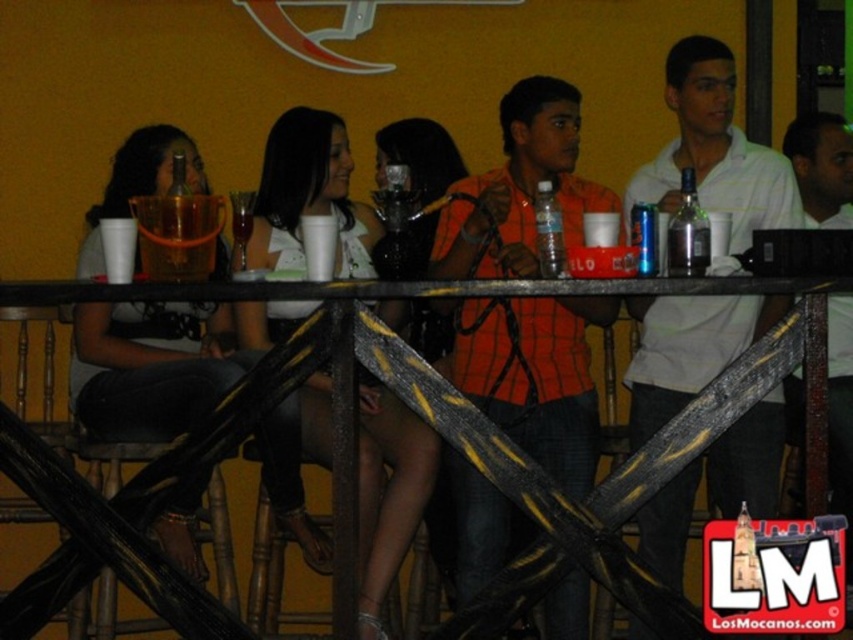
Question: Can you confirm if white cotton shirt at upper right is thinner than matte white cup at upper center?

Choices:
 (A) yes
 (B) no

Answer: (A)

Question: Which object is positioned closest to the orange checkered shirt at center?

Choices:
 (A) clear plastic bottle at center
 (B) matte white cup at upper center

Answer: (A)

Question: Which object is closer to the camera taking this photo?

Choices:
 (A) clear glass bottle at upper right
 (B) white cotton shirt at upper right
 (C) orange checkered shirt at center

Answer: (A)

Question: Is white cotton shirt at upper right to the right of clear plastic bottle at center from the viewer's perspective?

Choices:
 (A) no
 (B) yes

Answer: (B)

Question: Which of these objects is positioned farthest from the clear plastic bottle at center?

Choices:
 (A) matte white cup at upper center
 (B) orange checkered shirt at center

Answer: (A)

Question: Is clear glass bottle at upper right to the left of clear plastic bottle at center from the viewer's perspective?

Choices:
 (A) no
 (B) yes

Answer: (A)